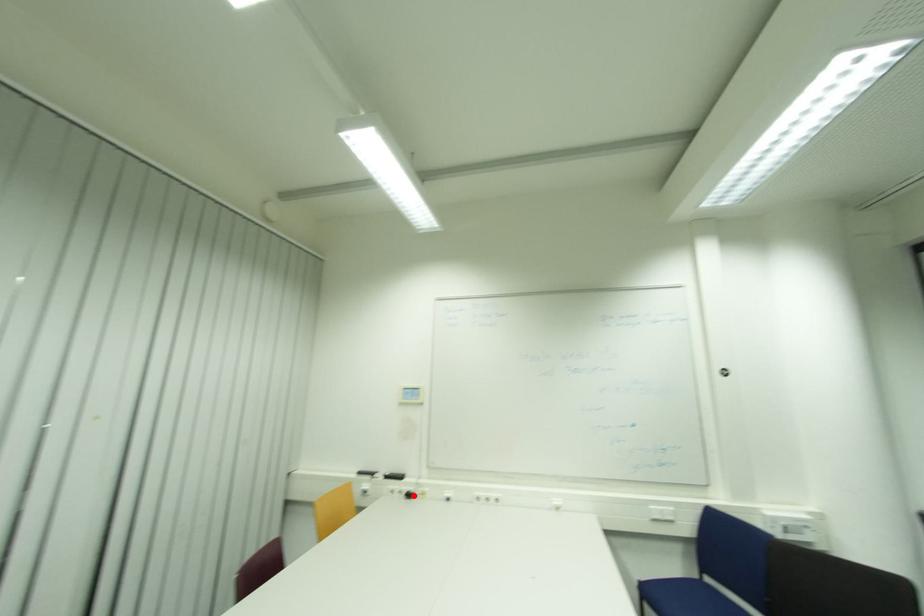
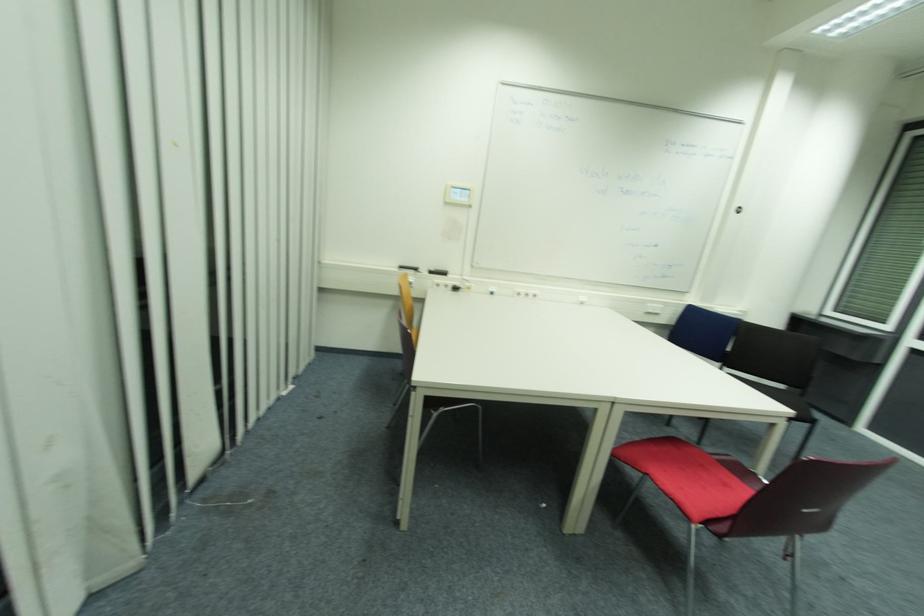
Find the pixel in the second image that matches the highlighted location in the first image.

(458, 290)